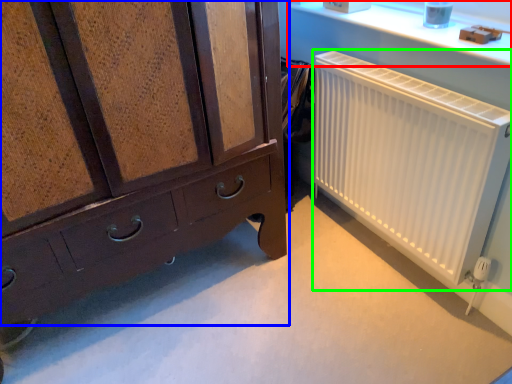
Question: Estimate the real-world distances between objects in this image. Which object is closer to window sill (highlighted by a red box), chest of drawers (highlighted by a blue box) or radiator (highlighted by a green box)?

Choices:
 (A) chest of drawers
 (B) radiator

Answer: (B)